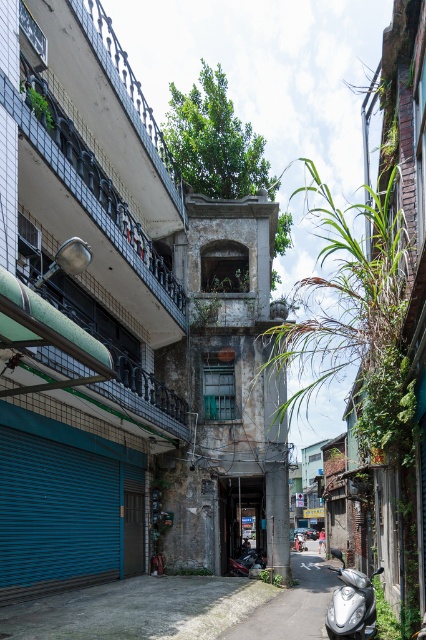
Is blue metallic garage door at lower left to the left of silver metallic scooter at lower right from the viewer's perspective?

Indeed, blue metallic garage door at lower left is positioned on the left side of silver metallic scooter at lower right.

Is blue metallic garage door at lower left above silver metallic scooter at lower right?

Yes, blue metallic garage door at lower left is above silver metallic scooter at lower right.

The image size is (426, 640). What are the coordinates of `blue metallic garage door at lower left` in the screenshot? It's located at (54, 516).

Where is `blue metallic garage door at lower left`? blue metallic garage door at lower left is located at coordinates (54, 516).